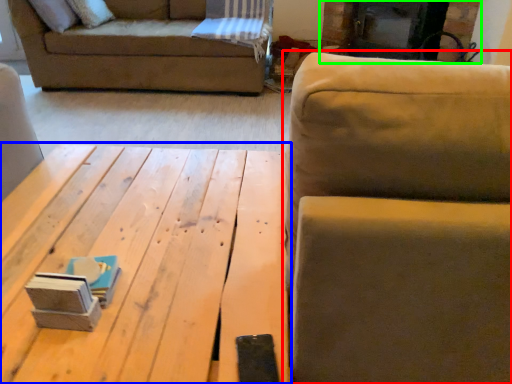
Question: Which object is positioned closest to studio couch (highlighted by a red box)? Select from table (highlighted by a blue box) and fireplace (highlighted by a green box).

Choices:
 (A) table
 (B) fireplace

Answer: (A)